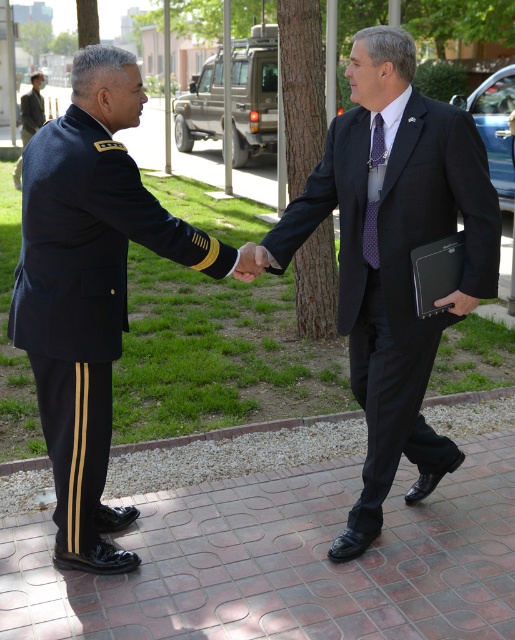
Question: Does brick pavement at center appear under black smooth suit at center?

Choices:
 (A) yes
 (B) no

Answer: (A)

Question: Which point is closer to the camera taking this photo?

Choices:
 (A) (334, 170)
 (B) (148, 246)

Answer: (B)

Question: Among these points, which one is nearest to the camera?

Choices:
 (A) (372, 253)
 (B) (351, 259)

Answer: (A)

Question: Where is black smooth suit at center located in relation to camouflage uniform at upper left in the image?

Choices:
 (A) above
 (B) below

Answer: (B)

Question: Is black smooth suit at center bigger than navy blue uniform at center?

Choices:
 (A) yes
 (B) no

Answer: (A)

Question: Which of the following is the farthest from the observer?

Choices:
 (A) camouflage uniform at upper left
 (B) brick pavement at center

Answer: (A)